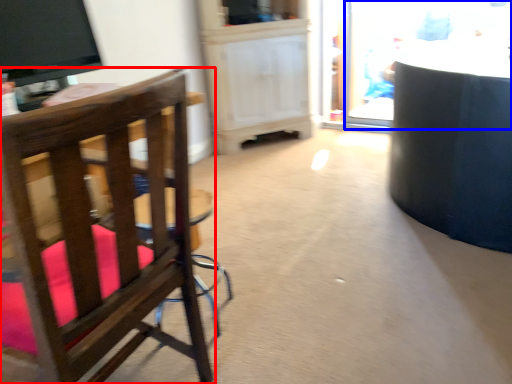
Question: Which object is further to the camera taking this photo, chair (highlighted by a red box) or glass door (highlighted by a blue box)?

Choices:
 (A) chair
 (B) glass door

Answer: (B)